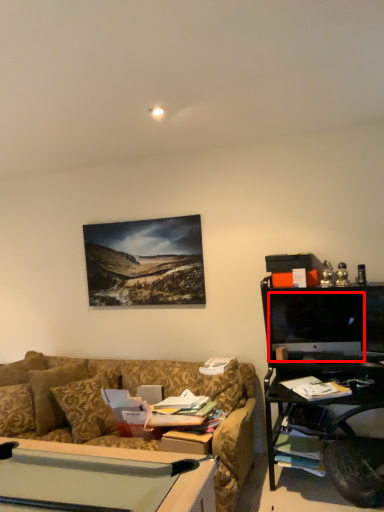
Question: In this image, where is computer monitor (annotated by the red box) located relative to pillow?

Choices:
 (A) left
 (B) right

Answer: (B)